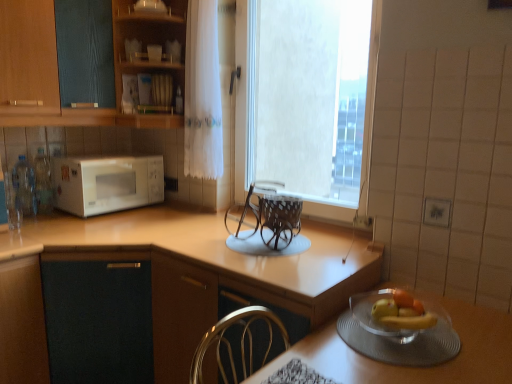
The image size is (512, 384). What are the coordinates of `free spot to the right of clear plastic bottles at left, the first bottle in the left-to-right sequence` in the screenshot? It's located at (56, 218).